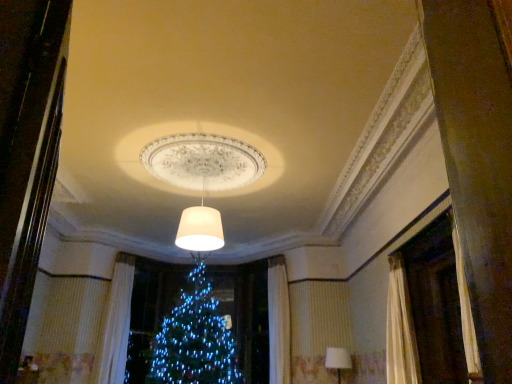
Question: Looking at their shapes, would you say white fabric lampshade at lower right, the second lamp in the left-to-right sequence, is wider or thinner than white matte lampshade at center, placed as the 1th lamp when sorted from front to back?

Choices:
 (A) wide
 (B) thin

Answer: (B)

Question: From the image's perspective, is white fabric lampshade at lower right, marked as the 1th lamp in a bottom-to-top arrangement, above or below white matte lampshade at center, marked as the 2th lamp in a bottom-to-top arrangement?

Choices:
 (A) below
 (B) above

Answer: (A)

Question: Which of these objects is positioned closest to the white textured curtain at left?

Choices:
 (A) white matte lampshade at center, placed as the 1th lamp when sorted from front to back
 (B) white fabric lampshade at lower right, marked as the 1th lamp in a bottom-to-top arrangement

Answer: (A)

Question: Based on their relative distances, which object is farther from the white textured curtain at left?

Choices:
 (A) white fabric lampshade at lower right, marked as the 1th lamp in a bottom-to-top arrangement
 (B) white matte lampshade at center, placed as the 1th lamp when sorted from front to back

Answer: (A)